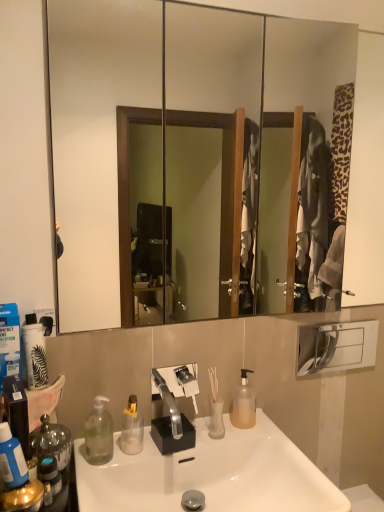
Find the location of a particular element. This screenshot has height=512, width=384. vacant area that is in front of translucent plastic pump bottle at center, which is the 1th bottle from right to left is located at coordinates (260, 439).